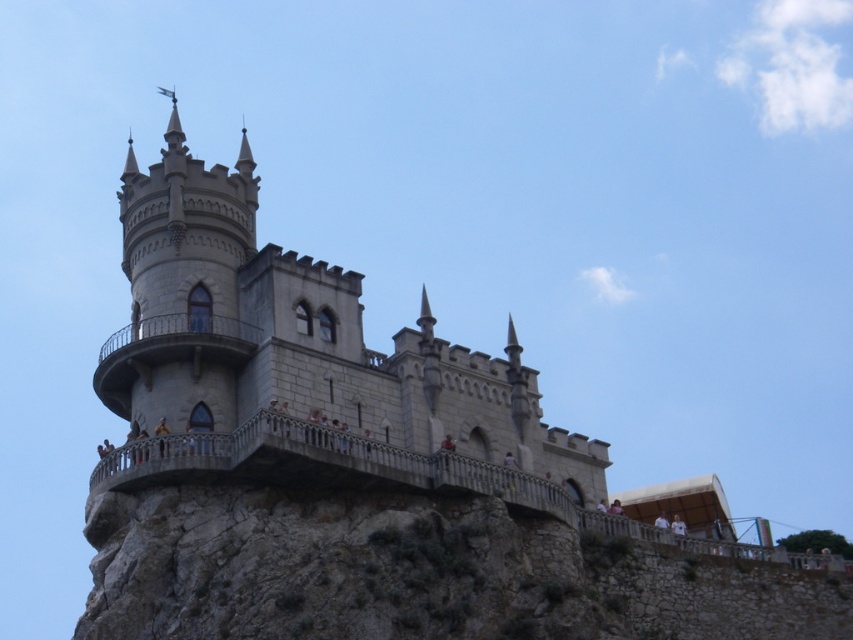
Is gray stone castle at center in front of gray stone hill at lower left?

No.

Is gray stone castle at center positioned behind gray stone hill at lower left?

Yes.

Image resolution: width=853 pixels, height=640 pixels. Find the location of `gray stone castle at center`. gray stone castle at center is located at coordinates (x=302, y=365).